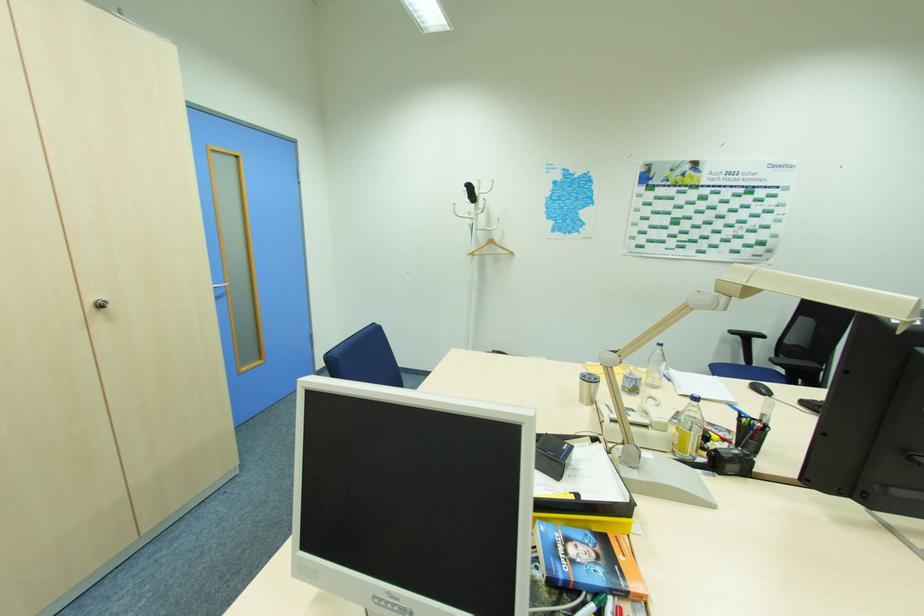
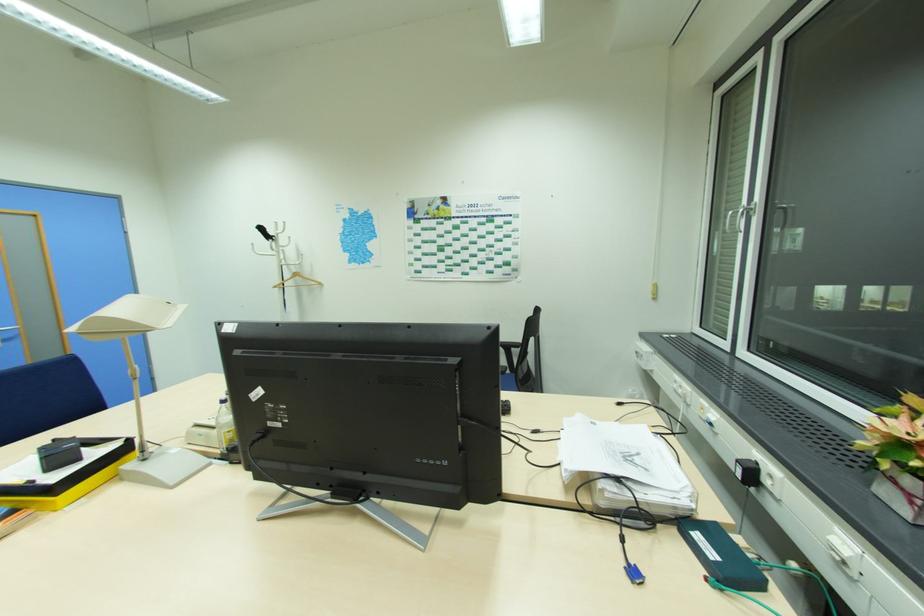
Find the pixel in the second image that matches point 222,294 in the first image.

(11, 337)